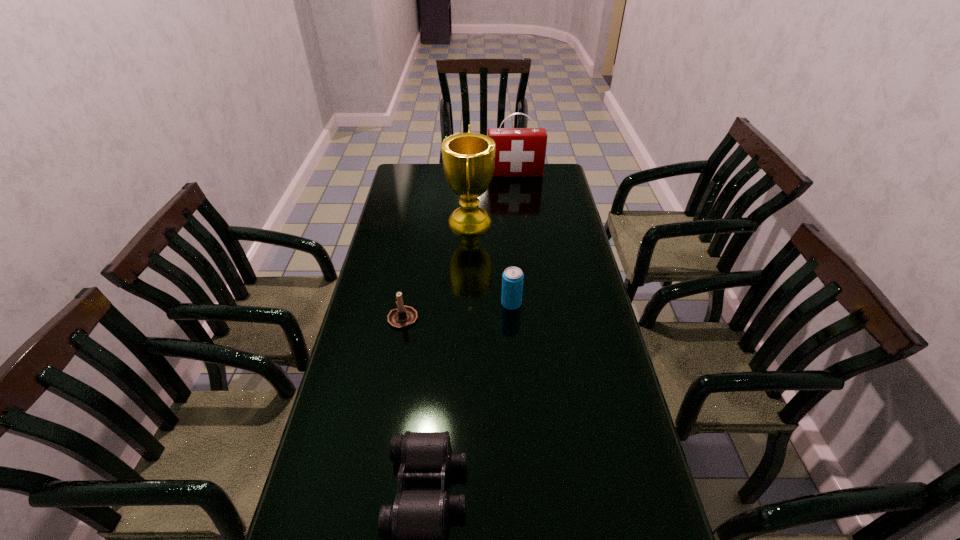
At what (x,y) coordinates should I click in order to perform the action: click on award. Please return your answer as a coordinate pair (x, y). This screenshot has height=540, width=960. Looking at the image, I should click on (468, 158).

Identify the location of the fourth nearest object. The image size is (960, 540). (468, 158).

Locate an element on the screen. This screenshot has height=540, width=960. the second tallest object is located at coordinates [520, 152].

The height and width of the screenshot is (540, 960). In order to click on the first-aid kit in this screenshot , I will do `click(520, 152)`.

You are a GUI agent. You are given a task and a screenshot of the screen. Output one action in this format:
    pyautogui.click(x=<x>, y=<y>)
    Task: Click on the soda can
    
    Given the screenshot: What is the action you would take?
    pyautogui.click(x=512, y=278)

Find the location of a particular element. The image size is (960, 540). candle holder is located at coordinates (403, 316).

Where is `vacant space located 0.140m on the shiny surface of the second farthest object`? This screenshot has height=540, width=960. vacant space located 0.140m on the shiny surface of the second farthest object is located at coordinates (529, 221).

You are a GUI agent. You are given a task and a screenshot of the screen. Output one action in this format:
    pyautogui.click(x=<x>, y=<y>)
    Task: Click on the free spot located 0.310m on the front face of the fourth shortest object
    Image resolution: width=960 pixels, height=540 pixels.
    Given the screenshot: What is the action you would take?
    pyautogui.click(x=520, y=216)

Where is `vacant space located on the front of the soda can`? vacant space located on the front of the soda can is located at coordinates (517, 382).

You are a GUI agent. You are given a task and a screenshot of the screen. Output one action in this format:
    pyautogui.click(x=<x>, y=<y>)
    Task: Click on the free region located on the right of the fourth tallest object
    
    Given the screenshot: What is the action you would take?
    pyautogui.click(x=513, y=318)